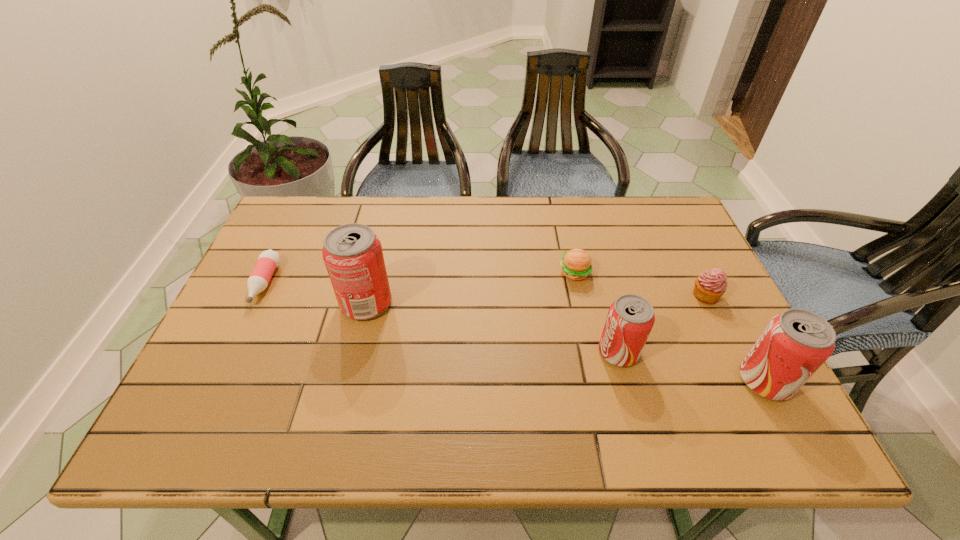
Identify the location of the second object from left to right. (352, 253).

The width and height of the screenshot is (960, 540). What are the coordinates of `the farthest soda can` in the screenshot? It's located at (352, 253).

Identify the location of the fourth shortest object. (630, 319).

You are a GUI agent. You are given a task and a screenshot of the screen. Output one action in this format:
    pyautogui.click(x=<x>, y=<y>)
    Task: Click on the second soda can from left to right
    
    Given the screenshot: What is the action you would take?
    pyautogui.click(x=630, y=319)

You are a GUI agent. You are given a task and a screenshot of the screen. Output one action in this format:
    pyautogui.click(x=<x>, y=<y>)
    Task: Click on the second shortest soda can
    This screenshot has height=540, width=960.
    Given the screenshot: What is the action you would take?
    pyautogui.click(x=795, y=343)

Find the location of a particular element. This screenshot has height=540, width=960. the second tallest object is located at coordinates (795, 343).

At what (x,y) coordinates should I click in order to perform the action: click on cupcake. Please return your answer as a coordinate pair (x, y). Image resolution: width=960 pixels, height=540 pixels. Looking at the image, I should click on (709, 287).

You are a GUI agent. You are given a task and a screenshot of the screen. Output one action in this format:
    pyautogui.click(x=<x>, y=<y>)
    Task: Click on the hamburger
    
    Given the screenshot: What is the action you would take?
    pyautogui.click(x=576, y=264)

Locate an element on the screen. The image size is (960, 540). the leftmost object is located at coordinates (268, 260).

Where is `the shortest object`? Image resolution: width=960 pixels, height=540 pixels. the shortest object is located at coordinates 268,260.